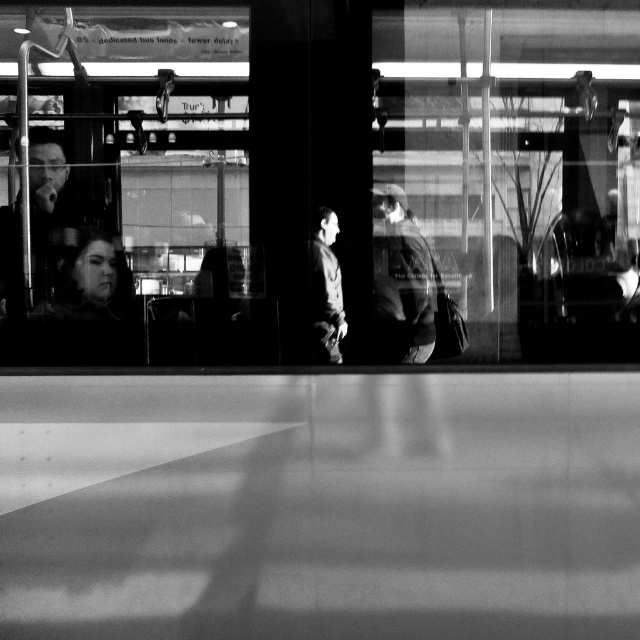
In the scene shown: Between dark fabric jacket at center and dark gray jacket at center, which one is positioned lower?

dark gray jacket at center is below.

Between point (413, 225) and point (324, 211), which one is positioned behind?

The point (413, 225) is more distant.

Identify the location of dark fabric jacket at center. (404, 282).